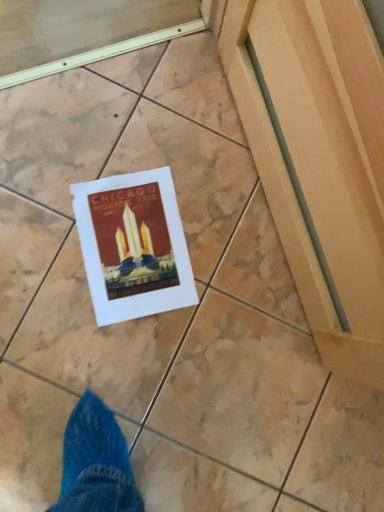
Identify the location of vacant space that is to the left of matte paper postcard at center. (53, 182).